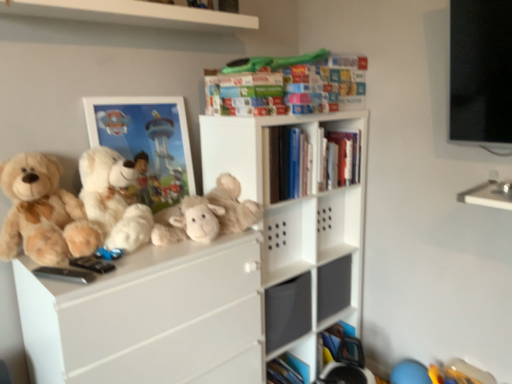
Question: Would you say soft beige teddy bear at left, which is the first teddy bear from left to right, is inside or outside white plush teddy bear at left, which is counted as the 1th teddy bear, starting from the right?

Choices:
 (A) outside
 (B) inside

Answer: (A)

Question: Is soft beige teddy bear at left, which is the first teddy bear from left to right, bigger or smaller than white plush teddy bear at left, the 2th teddy bear viewed from the left?

Choices:
 (A) big
 (B) small

Answer: (B)

Question: Estimate the real-world distances between objects in this image. Which object is farther from the soft beige teddy bear at left, which is the first teddy bear from left to right?

Choices:
 (A) matte plastic picture frame at upper left
 (B) multicolored cardboard book at upper center, which appears as the second book when ordered from the bottom
 (C) white plush teddy bear at left, which is counted as the 1th teddy bear, starting from the right
 (D) hardcover books at center, acting as the second book starting from the top
 (E) fluffy beige stuffed animal at center

Answer: (B)

Question: Based on their relative distances, which object is farther from the white plush teddy bear at left, which is counted as the 1th teddy bear, starting from the right?

Choices:
 (A) soft beige teddy bear at left, which ranks as the 2th teddy bear in right-to-left order
 (B) fluffy beige stuffed animal at center
 (C) matte plastic picture frame at upper left
 (D) multicolored cardboard book at upper center, which is counted as the 1th book, starting from the top
 (E) hardcover books at center, acting as the second book starting from the top

Answer: (D)